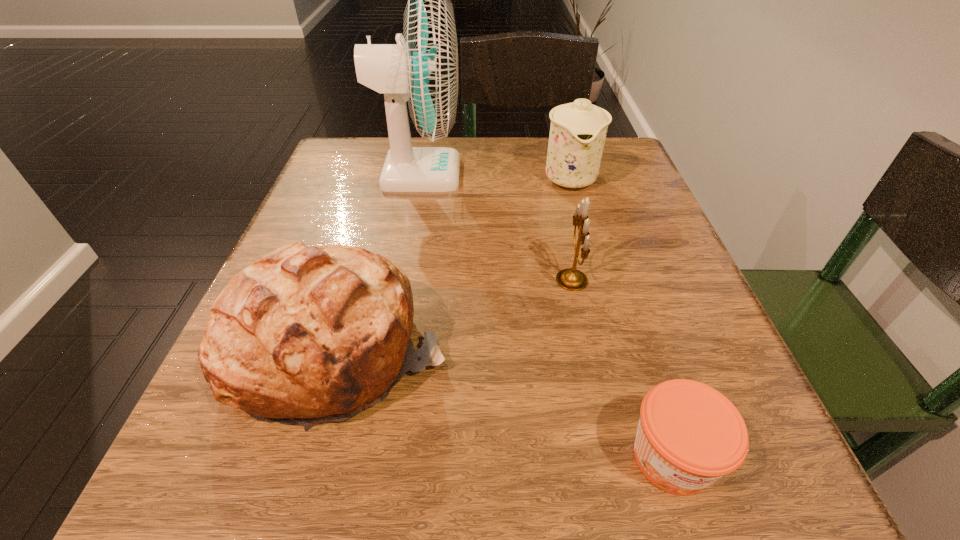
This screenshot has width=960, height=540. Identify the location of the tallest object. (423, 70).

The width and height of the screenshot is (960, 540). In order to click on chinaware in this screenshot , I will do `click(578, 130)`.

You are a GUI agent. You are given a task and a screenshot of the screen. Output one action in this format:
    pyautogui.click(x=<x>, y=<y>)
    Task: Click on the candelabrum
    The image size is (960, 540).
    Given the screenshot: What is the action you would take?
    pyautogui.click(x=571, y=279)

Locate an element on the screen. bread is located at coordinates (305, 335).

Locate an element on the screen. The image size is (960, 540). the shortest object is located at coordinates (689, 435).

I want to click on blank space located in front of the tallest object to face the airflow, so click(x=498, y=173).

Identify the location of vacant space situated on the spout of the chinaware. (601, 293).

Locate an element on the screen. vacant region located on the front of the candelabrum is located at coordinates (619, 502).

Image resolution: width=960 pixels, height=540 pixels. In order to click on vacant space located on the back of the bread in this screenshot , I will do `click(374, 224)`.

You are a GUI agent. You are given a task and a screenshot of the screen. Output one action in this format:
    pyautogui.click(x=<x>, y=<y>)
    Task: Click on the fan that is at the far edge
    This screenshot has height=540, width=960.
    Given the screenshot: What is the action you would take?
    pyautogui.click(x=423, y=70)